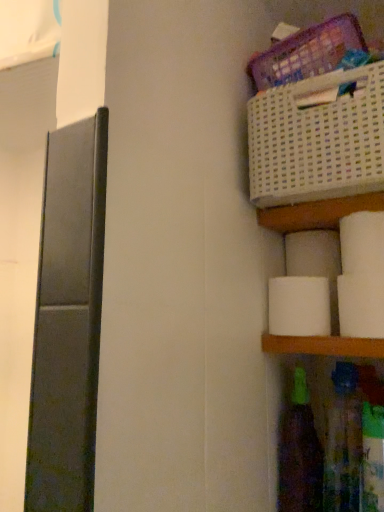
Question: From a real-world perspective, is white matte toilet paper at lower right, arranged as the first toilet paper when viewed from the front, located higher than white matte toilet paper at right, which is the 3th toilet paper from back to front?

Choices:
 (A) yes
 (B) no

Answer: (B)

Question: Is white matte toilet paper at lower right, arranged as the first toilet paper when viewed from the front, further to the viewer compared to white matte toilet paper at right, which is the 3th toilet paper from back to front?

Choices:
 (A) yes
 (B) no

Answer: (B)

Question: From the image's perspective, is white matte toilet paper at lower right, arranged as the first toilet paper when viewed from the front, over white matte toilet paper at right, which is counted as the 2th toilet paper, starting from the front?

Choices:
 (A) no
 (B) yes

Answer: (A)

Question: Does white matte toilet paper at lower right, the fourth toilet paper positioned from the back, have a lesser width compared to white matte toilet paper at right, which is counted as the 2th toilet paper, starting from the front?

Choices:
 (A) yes
 (B) no

Answer: (A)

Question: Considering the relative sizes of white matte toilet paper at lower right, the fourth toilet paper positioned from the back, and white matte toilet paper at right, which is the 3th toilet paper from back to front, in the image provided, is white matte toilet paper at lower right, the fourth toilet paper positioned from the back, taller than white matte toilet paper at right, which is the 3th toilet paper from back to front,?

Choices:
 (A) yes
 (B) no

Answer: (A)

Question: From a real-world perspective, relative to translucent plastic bottle at lower right, the first bottle in the left-to-right sequence, is white matte toilet paper at right, which is counted as the 2th toilet paper, starting from the front, vertically above or below?

Choices:
 (A) below
 (B) above

Answer: (B)

Question: In terms of size, does white matte toilet paper at right, which is counted as the 2th toilet paper, starting from the front, appear bigger or smaller than translucent plastic bottle at lower right, which is the second bottle from right to left?

Choices:
 (A) big
 (B) small

Answer: (B)

Question: Considering the positions of white matte toilet paper at right, which is counted as the 2th toilet paper, starting from the front, and translucent plastic bottle at lower right, the first bottle in the left-to-right sequence, in the image, is white matte toilet paper at right, which is counted as the 2th toilet paper, starting from the front, wider or thinner than translucent plastic bottle at lower right, the first bottle in the left-to-right sequence,?

Choices:
 (A) wide
 (B) thin

Answer: (B)

Question: In the image, is white matte toilet paper at right, which is the 3th toilet paper from back to front, positioned in front of or behind translucent plastic bottle at lower right, the first bottle in the left-to-right sequence?

Choices:
 (A) behind
 (B) front

Answer: (B)

Question: Is translucent plastic bottle at lower right, which is the second bottle from right to left, inside the boundaries of white matte toilet paper at lower right, arranged as the first toilet paper when viewed from the front, or outside?

Choices:
 (A) outside
 (B) inside

Answer: (A)

Question: In the image, is translucent plastic bottle at lower right, which is the second bottle from right to left, positioned in front of or behind white matte toilet paper at lower right, the fourth toilet paper positioned from the back?

Choices:
 (A) behind
 (B) front

Answer: (A)

Question: From a real-world perspective, relative to white matte toilet paper at lower right, arranged as the first toilet paper when viewed from the front, is translucent plastic bottle at lower right, the first bottle in the left-to-right sequence, vertically above or below?

Choices:
 (A) below
 (B) above

Answer: (A)

Question: From the image's perspective, is translucent plastic bottle at lower right, which is the second bottle from right to left, located above or below white matte toilet paper at lower right, the fourth toilet paper positioned from the back?

Choices:
 (A) above
 (B) below

Answer: (B)

Question: From a real-world perspective, relative to translucent plastic bottle at lower right, the first bottle in the left-to-right sequence, is white matte toilet paper at right, marked as the 3th toilet paper in a front-to-back arrangement, vertically above or below?

Choices:
 (A) below
 (B) above

Answer: (B)

Question: Is point (327, 317) closer or farther from the camera than point (294, 485)?

Choices:
 (A) closer
 (B) farther

Answer: (B)